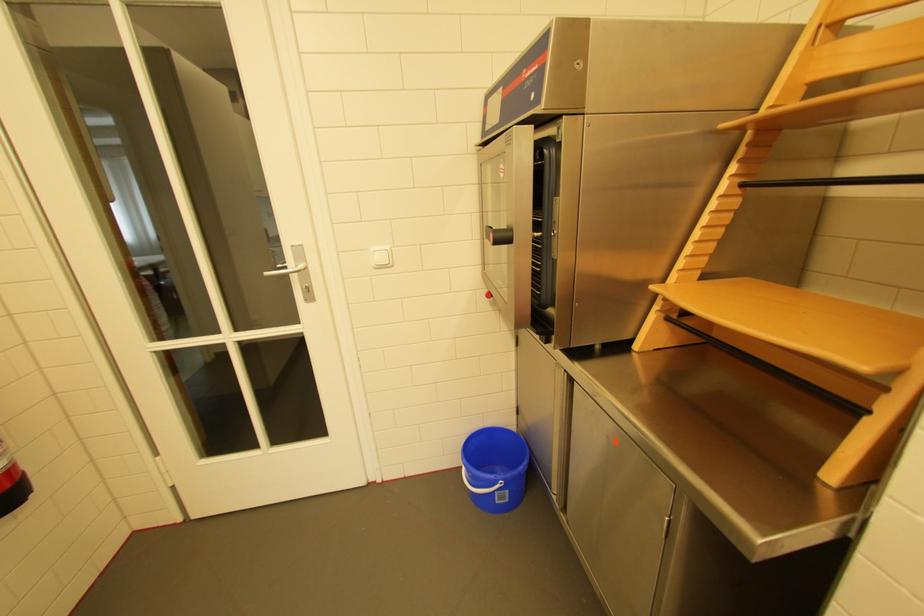
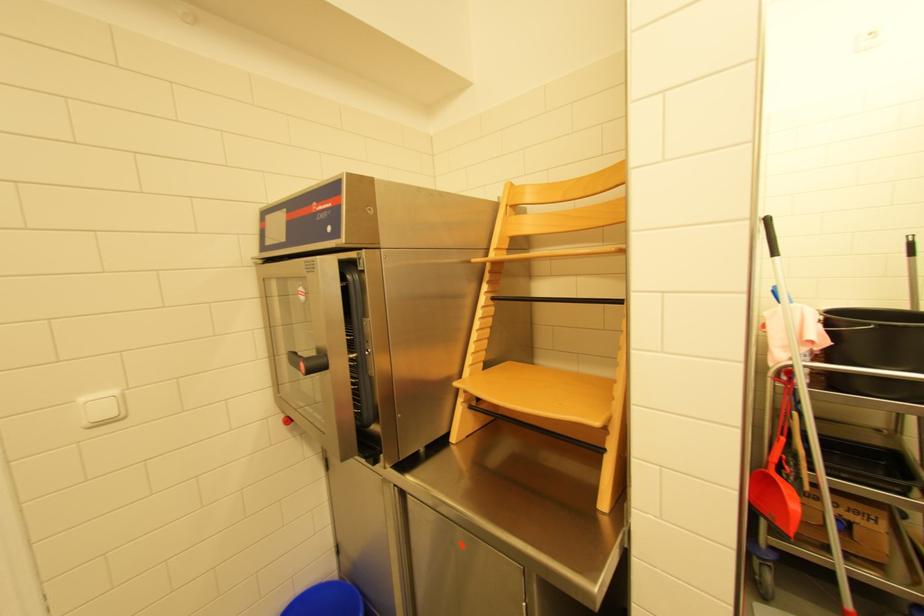
The point at (380, 249) is marked in the first image. Where is the corresponding point in the second image?

(90, 400)